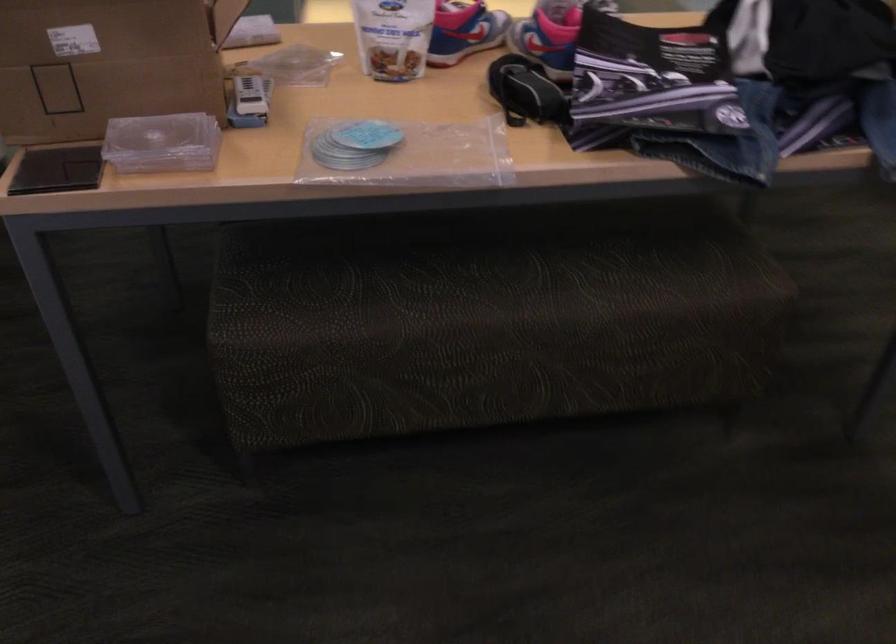
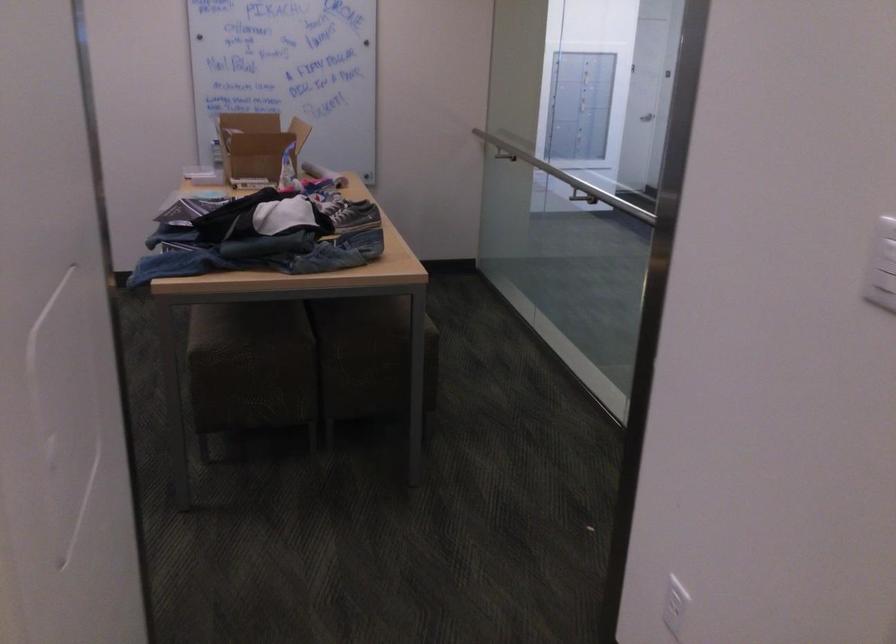
In the second image, find the point that corresponds to (x=679, y=228) in the first image.

(246, 325)